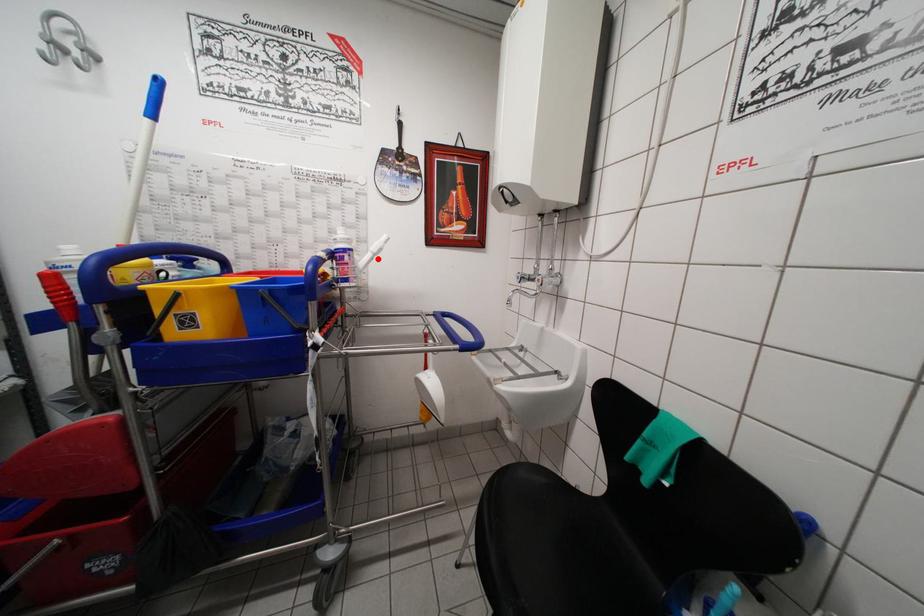
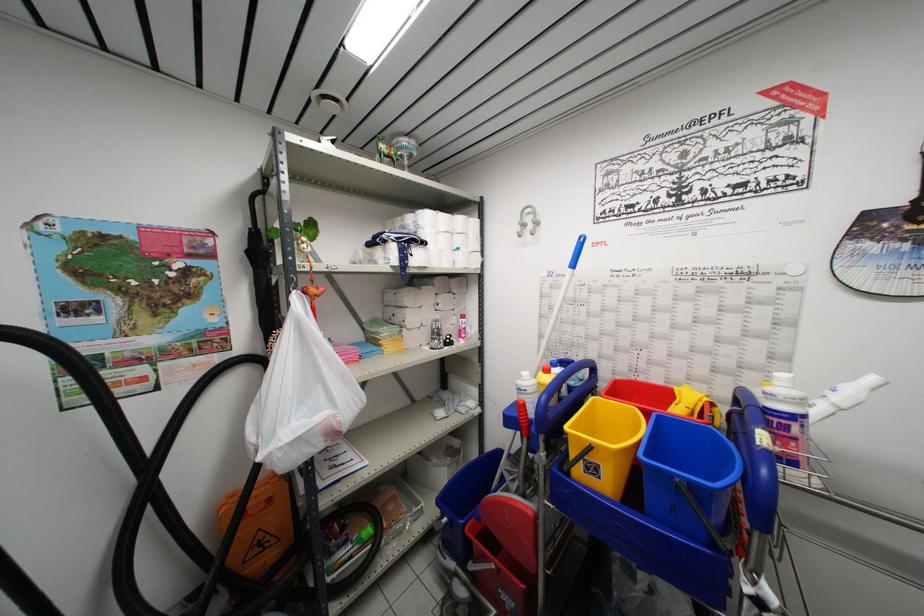
Where in the second image is the point corresponding to the highlighted location from the first image?

(845, 415)